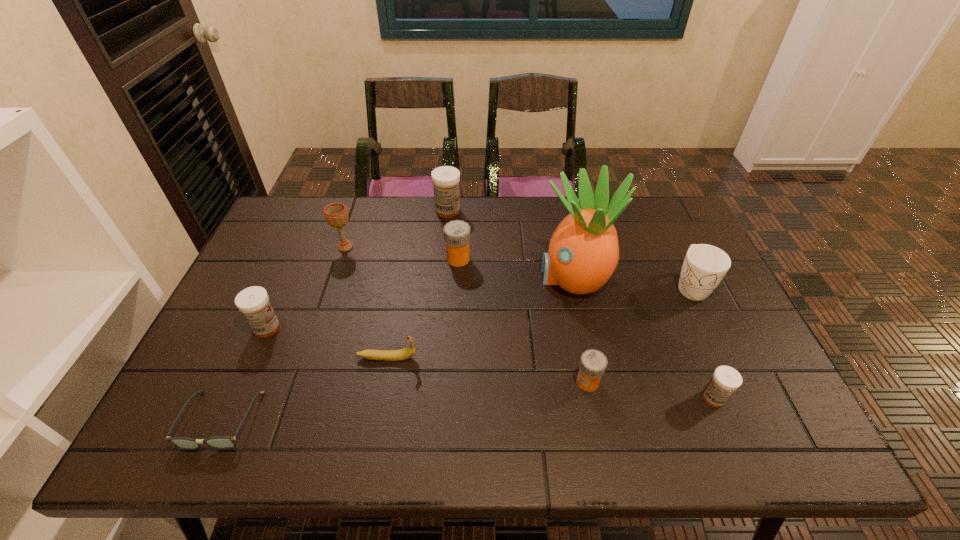
Where is `vacant space located 0.400m at the entrance of the tallest object`? vacant space located 0.400m at the entrance of the tallest object is located at coordinates (400, 277).

In order to click on free spot located at the entrance of the tallest object in this screenshot , I will do `click(465, 277)`.

Where is `free space located 0.260m on the right of the farthest white medicine`? free space located 0.260m on the right of the farthest white medicine is located at coordinates (536, 211).

Find the location of `vacant space located on the right of the chalice`. vacant space located on the right of the chalice is located at coordinates (480, 247).

Where is `blank space located 0.310m on the side of the mug with the handle`? Image resolution: width=960 pixels, height=540 pixels. blank space located 0.310m on the side of the mug with the handle is located at coordinates (748, 408).

The width and height of the screenshot is (960, 540). I want to click on free location located 0.230m on the label side of the left orange medicine, so click(545, 259).

This screenshot has height=540, width=960. Find the location of `blank space located 0.210m on the back of the second biggest white medicine`. blank space located 0.210m on the back of the second biggest white medicine is located at coordinates (295, 264).

At what (x,y) coordinates should I click in order to perform the action: click on vacant space located 0.290m at the stem of the fourth nearest object. Please return your answer as a coordinate pair (x, y). Looking at the image, I should click on (534, 357).

Locate an element on the screen. vacant region located on the label side of the smaller orange medicine is located at coordinates (x=488, y=382).

Locate an element on the screen. Image resolution: width=960 pixels, height=540 pixels. free space located 0.380m on the label side of the smaller orange medicine is located at coordinates (417, 382).